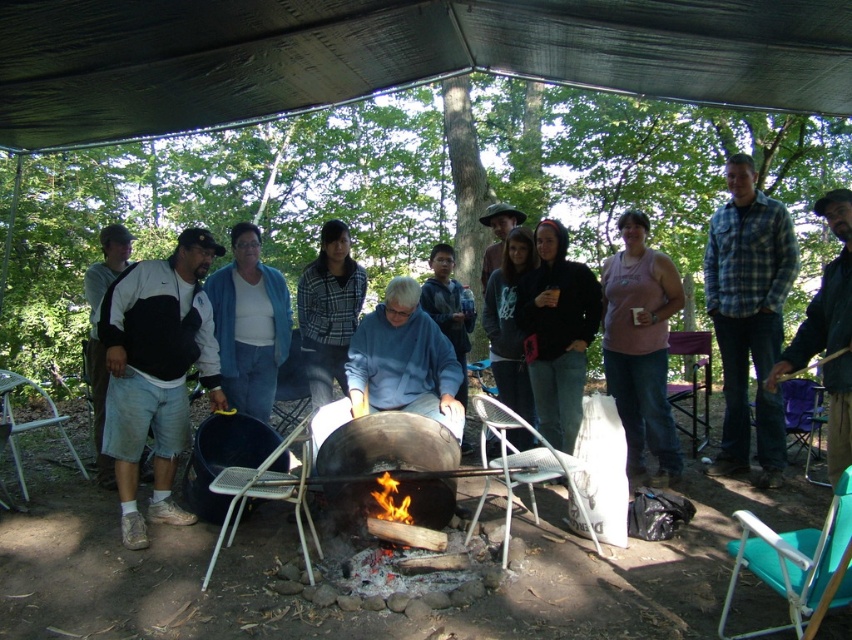
Question: Observing the image, what is the correct spatial positioning of pink fabric shirt at center in reference to flamewood at center?

Choices:
 (A) left
 (B) right

Answer: (B)

Question: Which is nearer to the charcoal black fire pit at center?

Choices:
 (A) blue denim jacket at center
 (B) pink fabric shirt at center
 (C) flamewood at center
 (D) dark gray fabric canopy at upper center

Answer: (C)

Question: Considering the relative positions of dark gray fabric canopy at upper center and pink fabric shirt at center in the image provided, where is dark gray fabric canopy at upper center located with respect to pink fabric shirt at center?

Choices:
 (A) below
 (B) above

Answer: (B)

Question: Considering the real-world distances, which object is closest to the dark gray fabric canopy at upper center?

Choices:
 (A) charcoal black fire pit at center
 (B) blue denim jacket at center
 (C) pink fabric shirt at center
 (D) flamewood at center

Answer: (C)

Question: Does dark gray fabric canopy at upper center have a larger size compared to pink fabric shirt at center?

Choices:
 (A) no
 (B) yes

Answer: (B)

Question: Among these objects, which one is farthest from the camera?

Choices:
 (A) pink fabric shirt at center
 (B) charcoal black fire pit at center
 (C) dark gray fabric canopy at upper center
 (D) flamewood at center

Answer: (A)